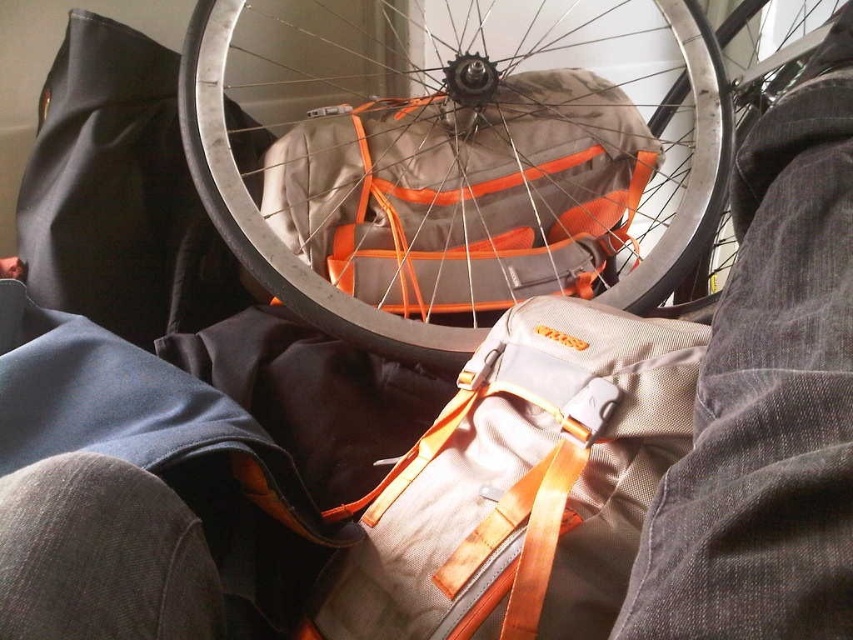
Is matte gray backpack at center in front of shiny metallic rim at center?

That is True.

Who is more forward, (480, 632) or (776, 84)?

Positioned in front is point (480, 632).

What do you see at coordinates (523, 483) in the screenshot? I see `matte gray backpack at center` at bounding box center [523, 483].

At what (x,y) coordinates should I click in order to perform the action: click on matte gray backpack at center. Please return your answer as a coordinate pair (x, y). The height and width of the screenshot is (640, 853). Looking at the image, I should click on (523, 483).

Does gray fabric pants at lower right have a lesser height compared to shiny metallic rim at center?

In fact, gray fabric pants at lower right may be taller than shiny metallic rim at center.

Does gray fabric pants at lower right come behind shiny metallic rim at center?

No.

Is point (801, 186) closer to viewer compared to point (846, 76)?

Yes, it is in front of point (846, 76).

This screenshot has height=640, width=853. I want to click on gray fabric pants at lower right, so click(769, 397).

Does matte gray backpack at center appear on the left side of gray fabric pants at lower right?

Indeed, matte gray backpack at center is positioned on the left side of gray fabric pants at lower right.

Who is more distant from viewer, (498, 403) or (820, 529)?

Point (498, 403)

At what (x,y) coordinates should I click in order to perform the action: click on matte gray backpack at center. Please return your answer as a coordinate pair (x, y). Looking at the image, I should click on (523, 483).